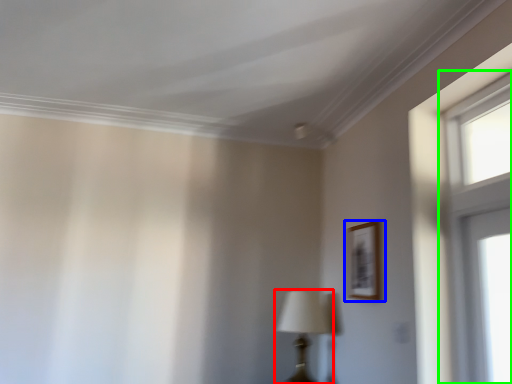
Question: Considering the real-world distances, which object is closest to table lamp (highlighted by a red box)? picture frame (highlighted by a blue box) or window (highlighted by a green box).

Choices:
 (A) picture frame
 (B) window

Answer: (A)